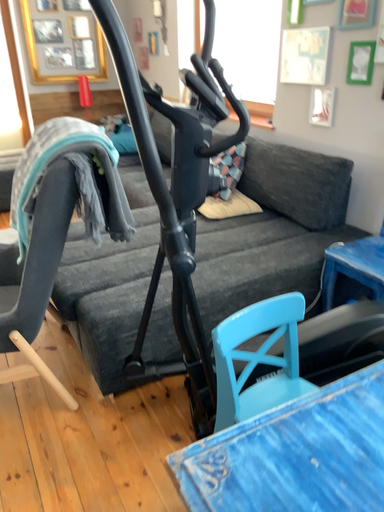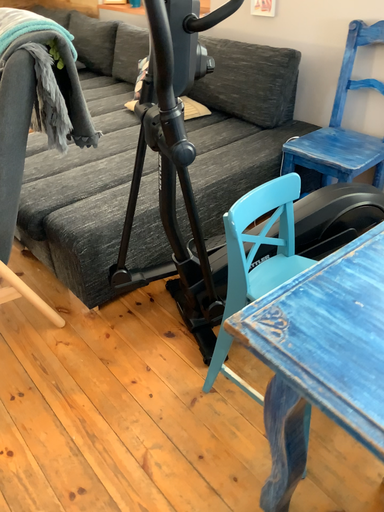
Question: How did the camera likely rotate when shooting the video?

Choices:
 (A) rotated left
 (B) rotated right

Answer: (B)